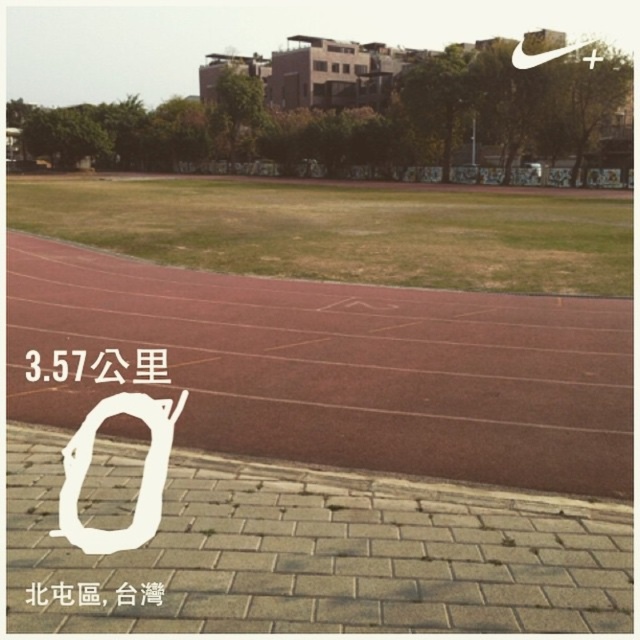
How distant is rubberized red track at center from black paper at center?

rubberized red track at center and black paper at center are 1.77 meters apart from each other.

Who is lower down, rubberized red track at center or black paper at center?

black paper at center

Which is in front, point (387, 404) or point (29, 356)?

Point (387, 404) is more forward.

Where is `rubberized red track at center`? The width and height of the screenshot is (640, 640). rubberized red track at center is located at coordinates (344, 368).